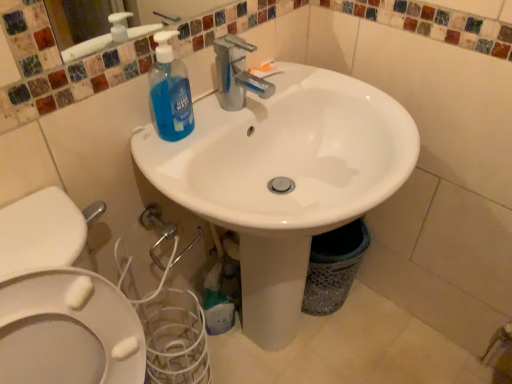
Question: Considering the positions of point (220, 309) and point (161, 89), is point (220, 309) closer or farther from the camera than point (161, 89)?

Choices:
 (A) closer
 (B) farther

Answer: (B)

Question: From their relative heights in the image, would you say translucent plastic bottle at lower center, positioned as the 2th cleaning product in front-to-back order, is taller or shorter than blue translucent liquid soap at upper left, which ranks as the first cleaning product in front-to-back order?

Choices:
 (A) tall
 (B) short

Answer: (A)

Question: Which is farther from the translucent plastic bottle at lower center, the first cleaning product when ordered from bottom to top?

Choices:
 (A) white glossy sink at center
 (B) blue translucent liquid soap at upper left, positioned as the first cleaning product in top-to-bottom order

Answer: (B)

Question: Considering the real-world distances, which object is farthest from the white glossy sink at center?

Choices:
 (A) translucent plastic bottle at lower center, acting as the 2th cleaning product starting from the top
 (B) blue translucent liquid soap at upper left, placed as the 2th cleaning product when sorted from back to front

Answer: (A)